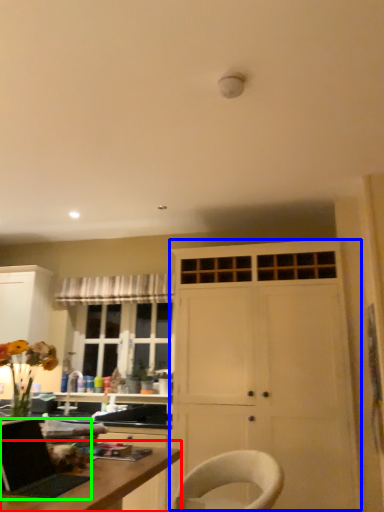
Question: Based on their relative distances, which object is nearer to desk (highlighted by a red box)? Choose from cabinetry (highlighted by a blue box) and laptop (highlighted by a green box).

Choices:
 (A) cabinetry
 (B) laptop

Answer: (B)